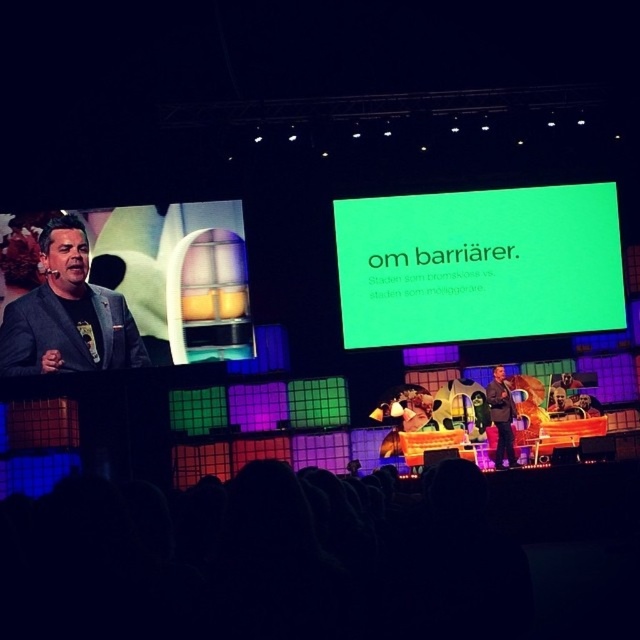
You are an event planner setting up a camera to capture the presenter in the black matte suit at left. The camera is placed at the audience area. Based on the coordinates given, where should the camera be positioned to focus on the presenter?

The presenter in the black matte suit at left is located at coordinates point (67, 333). To focus on them, the camera should be positioned to aim directly at those coordinates.

You are standing in the audience looking at the stage. There are two points marked on the stage. The first point is at coordinates point (429,330) and the second is at point (508,442). Which point appears closer to you?

Point (508,442) appears closer to you because it is closer to the camera than point (429,330).

You are standing in the audience looking at the stage. There are two points marked on the stage. The first point is at position (456, 260) and the second is at (6, 352). Which point is closer to you?

Point (6, 352) is closer to you because it is nearer to the audience compared to point (456, 260) which is further away.